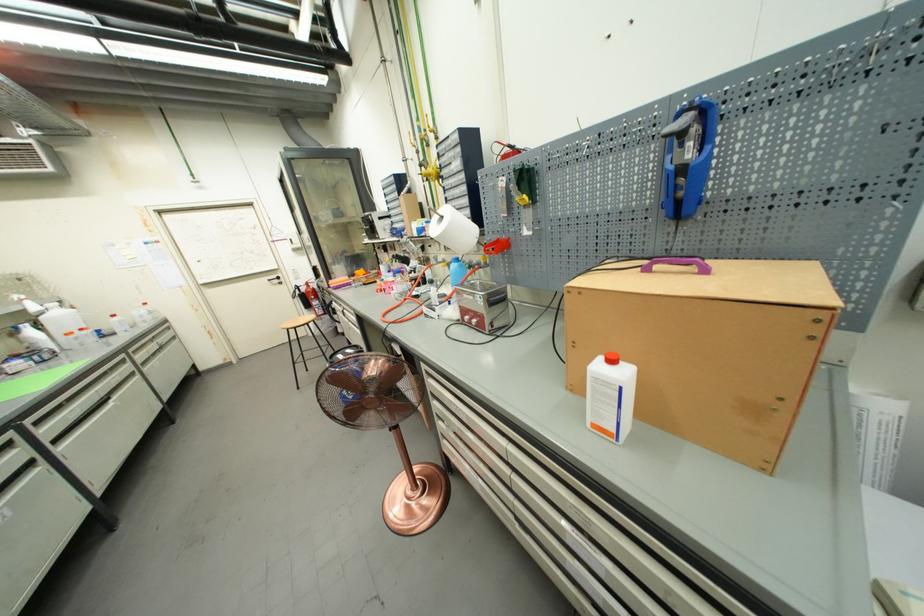
This screenshot has height=616, width=924. Describe the element at coordinates (313, 299) in the screenshot. I see `a fire extinguisher handle` at that location.